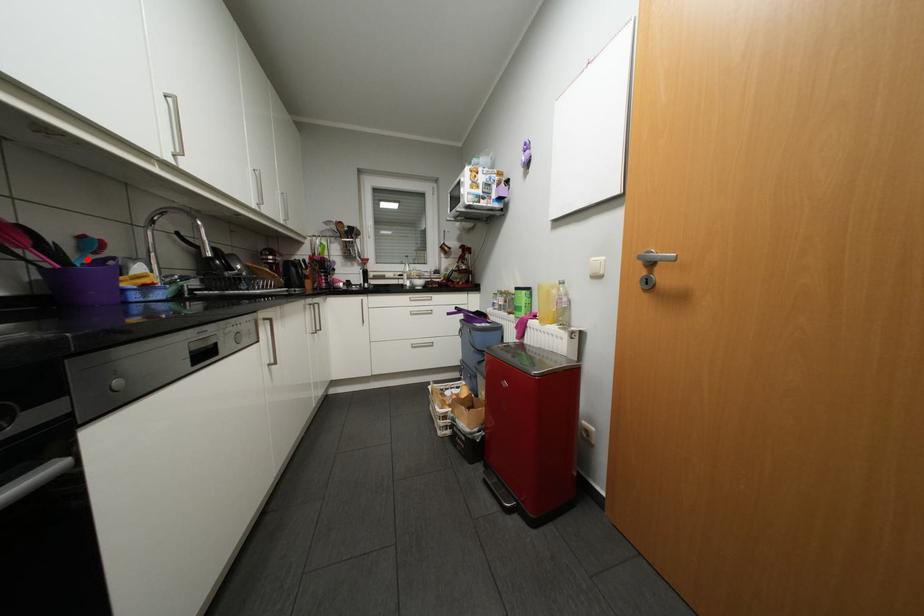
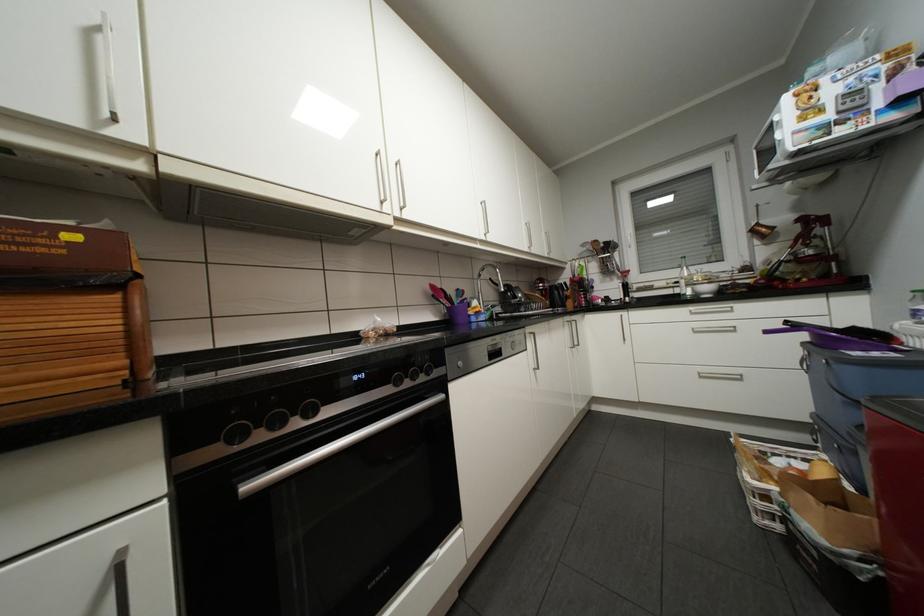
In the second image, find the point that corresponds to the highlighted location in the first image.

(465, 301)